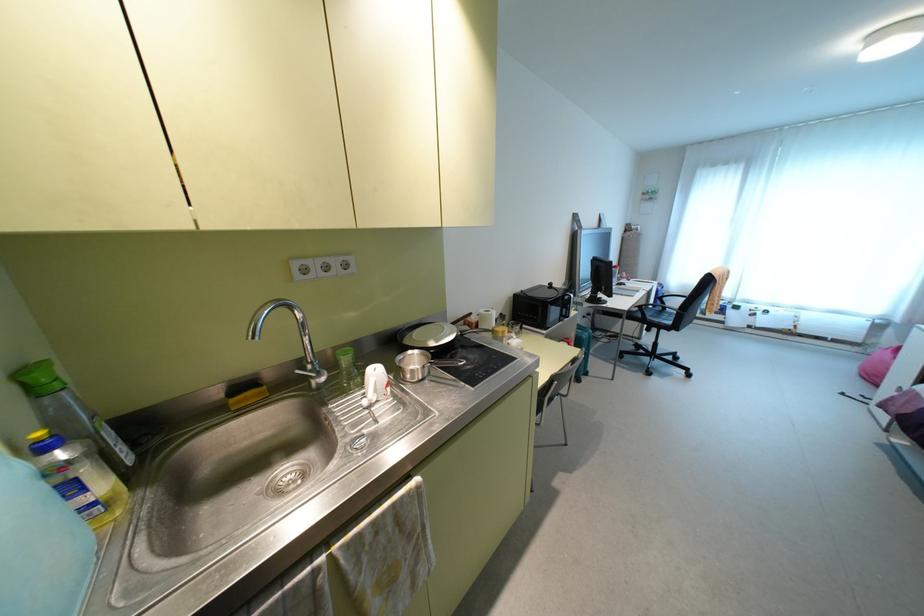
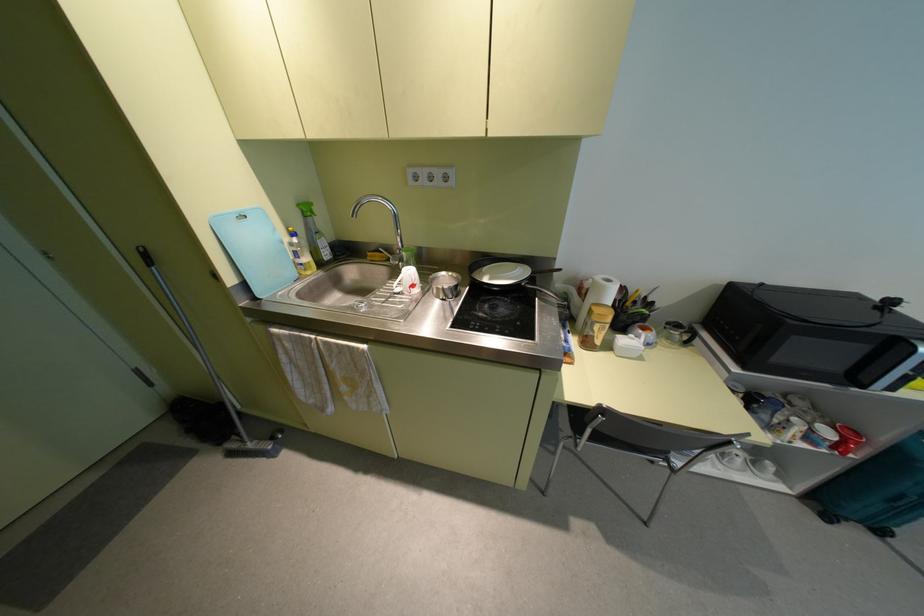
The point at [585,373] is marked in the first image. Where is the corresponding point in the second image?

(880, 531)